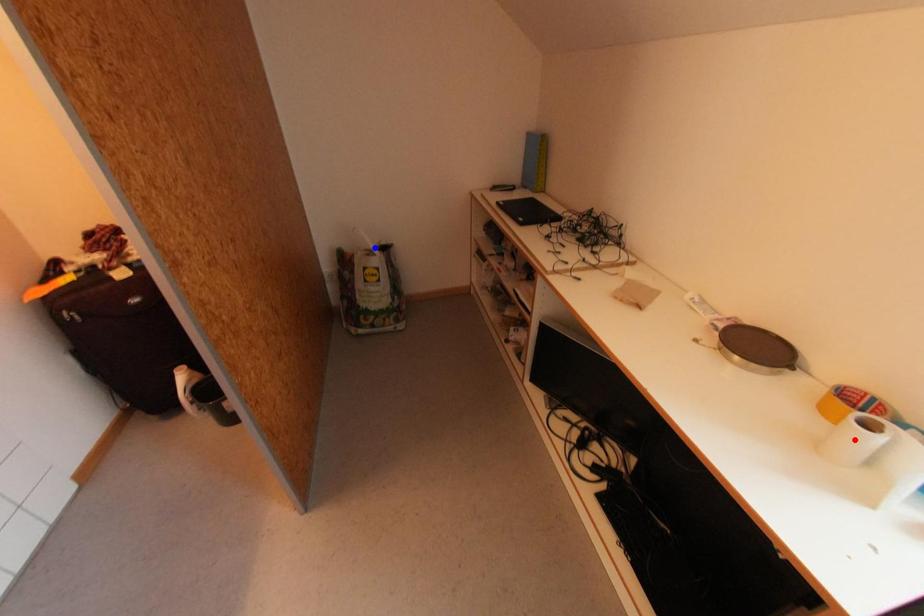
Question: Two points are marked on the image. Which point is closer to the camera?

Choices:
 (A) Blue point is closer.
 (B) Red point is closer.

Answer: (B)